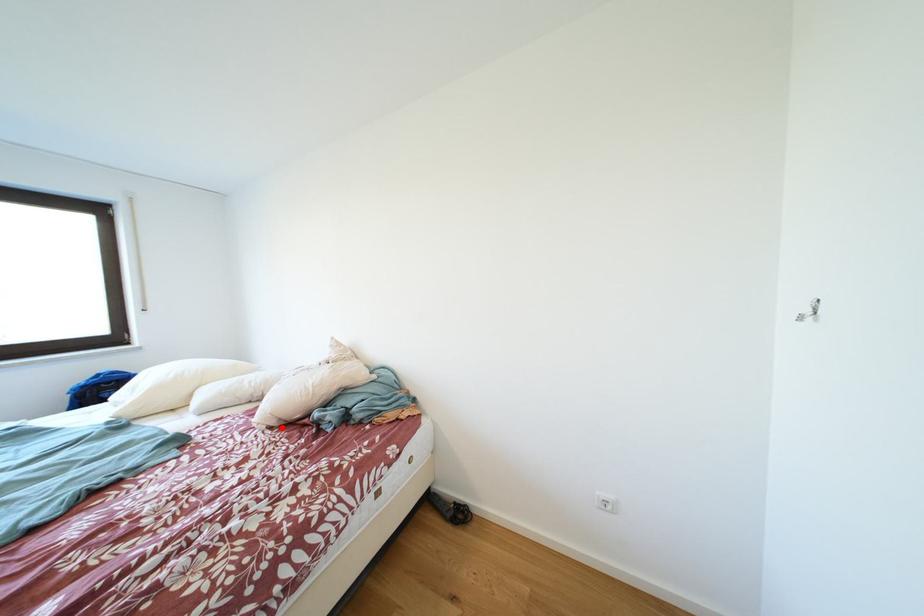
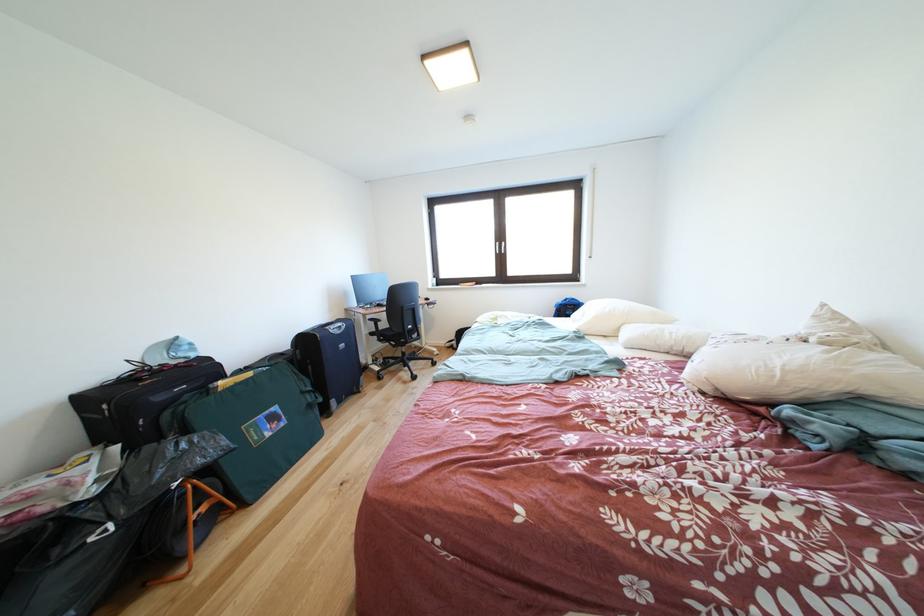
Locate, in the second image, the point that corresponds to the highlighted location in the first image.

(716, 394)